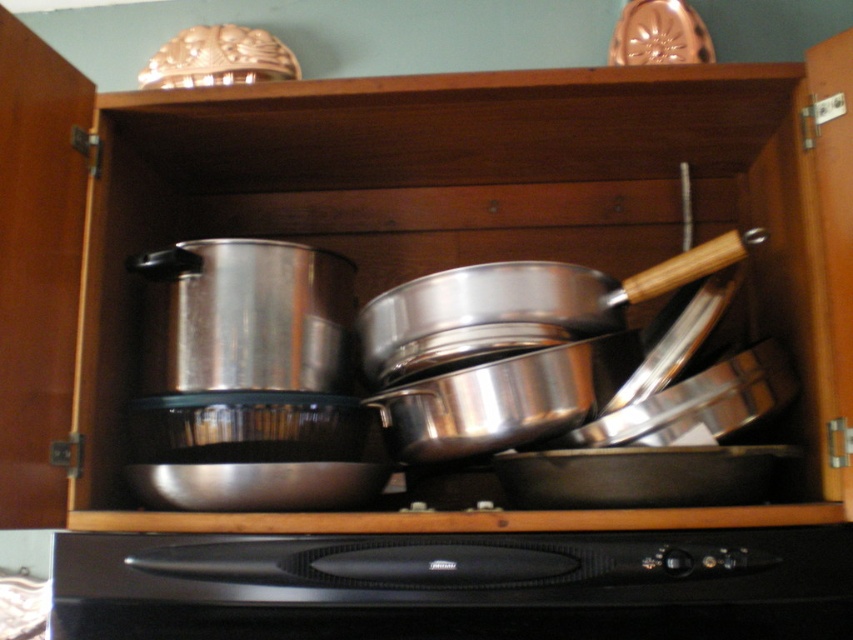
Looking at this image, can you confirm if black matte oven at bottom is thinner than shiny silver frying pan at center?

No, black matte oven at bottom is not thinner than shiny silver frying pan at center.

Can you confirm if black matte oven at bottom is shorter than shiny silver frying pan at center?

Indeed, black matte oven at bottom has a lesser height compared to shiny silver frying pan at center.

Does point (194, 556) lie behind point (590, 307)?

No, (194, 556) is in front of (590, 307).

Where is `black matte oven at bottom`? The height and width of the screenshot is (640, 853). black matte oven at bottom is located at coordinates (456, 586).